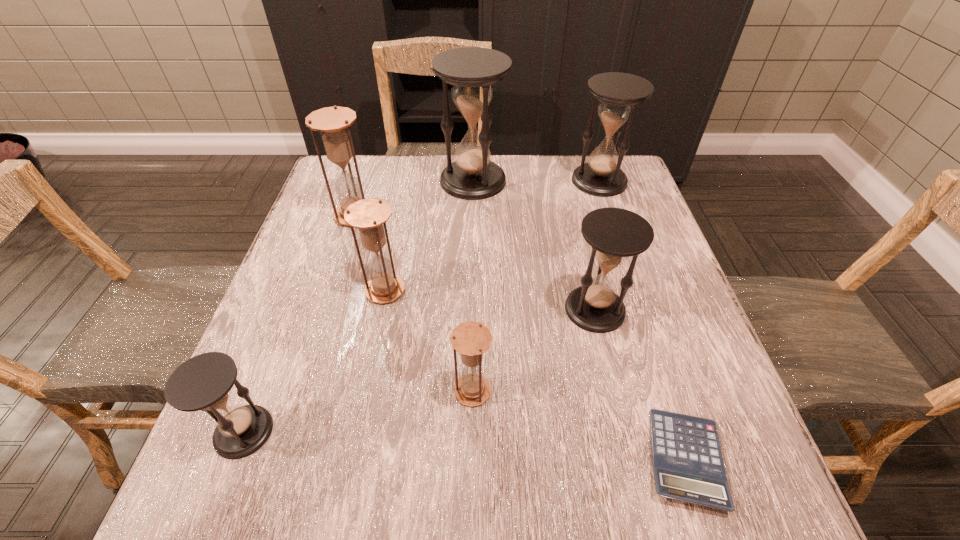
Locate an element on the screen. This screenshot has height=540, width=960. vacant space located 0.280m on the left of the calculator is located at coordinates (466, 459).

Locate an element on the screen. hourglass located in the near edge section of the desktop is located at coordinates (203, 382).

Locate an element on the screen. This screenshot has height=540, width=960. calculator that is at the near edge is located at coordinates (688, 466).

Where is `calculator present at the right edge`? calculator present at the right edge is located at coordinates pyautogui.click(x=688, y=466).

Find the location of `object that is positioned at the far left corner`. object that is positioned at the far left corner is located at coordinates (333, 123).

Locate an element on the screen. The height and width of the screenshot is (540, 960). object positioned at the near left corner is located at coordinates (203, 382).

Locate an element on the screen. object at the far right corner is located at coordinates (619, 94).

What are the coordinates of `object that is at the near right corner` in the screenshot? It's located at (688, 466).

Where is `vacant space at the far edge`? The image size is (960, 540). vacant space at the far edge is located at coordinates (434, 160).

You are a GUI agent. You are given a task and a screenshot of the screen. Output one action in this format:
    pyautogui.click(x=<x>, y=<y>)
    Task: Click on the free spot at the near edge of the desktop
    This screenshot has height=540, width=960.
    Given the screenshot: What is the action you would take?
    pyautogui.click(x=341, y=467)